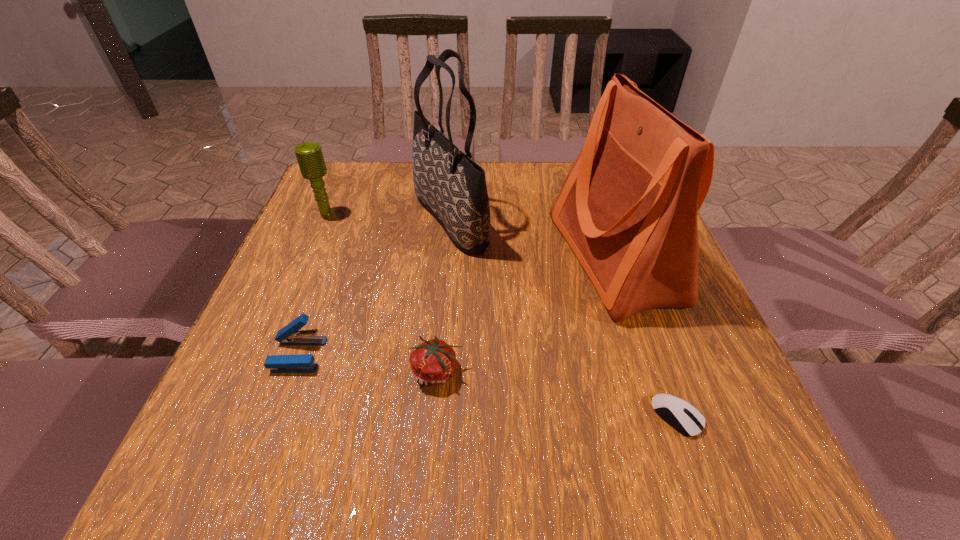
Locate an element on the screen. tote bag is located at coordinates (452, 187).

Image resolution: width=960 pixels, height=540 pixels. I want to click on shopping bag, so click(x=628, y=207).

Find the location of a particular element. The height and width of the screenshot is (540, 960). the third tallest object is located at coordinates (309, 155).

At what (x,y) coordinates should I click in order to perform the action: click on stapler. Please return your answer as a coordinate pair (x, y). This screenshot has height=540, width=960. Looking at the image, I should click on (291, 334).

Image resolution: width=960 pixels, height=540 pixels. I want to click on tomato, so click(433, 362).

You are a GUI agent. You are given a task and a screenshot of the screen. Output one action in this format:
    pyautogui.click(x=<x>, y=<y>)
    Task: Click on the mouse
    
    Given the screenshot: What is the action you would take?
    pyautogui.click(x=685, y=418)

This screenshot has height=540, width=960. Identify the location of the nearest object. (685, 418).

Identify the location of vacant area located on the front of the tote bag. (444, 295).

This screenshot has width=960, height=540. In order to click on vacant region located on the back of the shopping bag in this screenshot , I will do `click(585, 172)`.

Where is `free location located on the back of the microphone`? free location located on the back of the microphone is located at coordinates (341, 181).